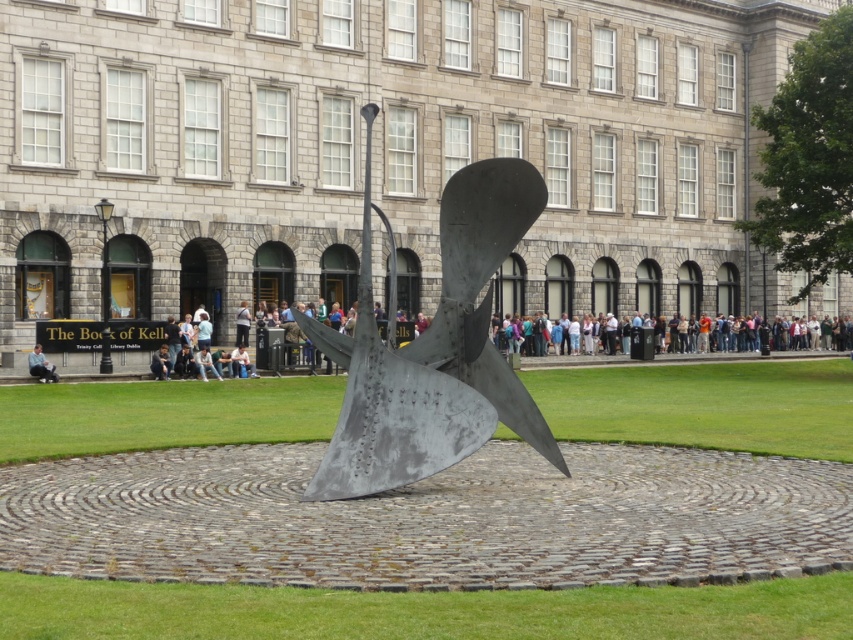
Is point (51, 592) closer to viewer compared to point (35, 355)?

That is True.

Who is positioned more to the left, green grass at center or light blue jeans at lower left?

Positioned to the left is light blue jeans at lower left.

Locate an element on the screen. Image resolution: width=853 pixels, height=640 pixels. green grass at center is located at coordinates (422, 611).

Is point (840, 435) positioned behind point (248, 368)?

That is False.

How far apart are metallic grass at center and light blue denim jeans at lower center?

A distance of 10.83 meters exists between metallic grass at center and light blue denim jeans at lower center.

Does point (776, 403) come farther from viewer compared to point (213, 365)?

No, it is in front of (213, 365).

I want to click on metallic grass at center, so click(x=705, y=404).

Which is above, metallic sculpture at center or light blue jeans at lower left?

Positioned higher is metallic sculpture at center.

In the scene shown: Can you confirm if metallic sculpture at center is shorter than light blue jeans at lower left?

In fact, metallic sculpture at center may be taller than light blue jeans at lower left.

Is point (490, 397) positioned before point (32, 355)?

Yes, point (490, 397) is closer to viewer.

Where is `metallic sculpture at center`? The height and width of the screenshot is (640, 853). metallic sculpture at center is located at coordinates (434, 348).